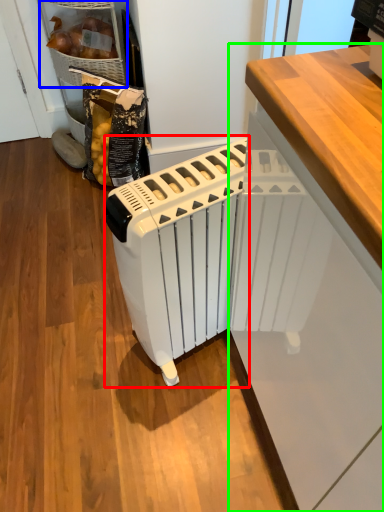
Question: Which object is positioned closest to home appliance (highlighted by a red box)? Select from cabinetry (highlighted by a blue box) and cabinetry (highlighted by a green box).

Choices:
 (A) cabinetry
 (B) cabinetry

Answer: (B)